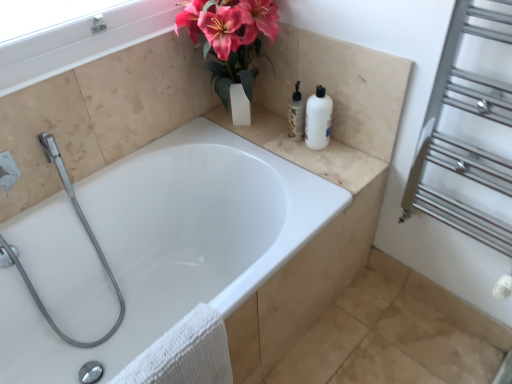
Image resolution: width=512 pixels, height=384 pixels. I want to click on vacant area that is in front of white plastic bottle at upper right, so click(x=329, y=165).